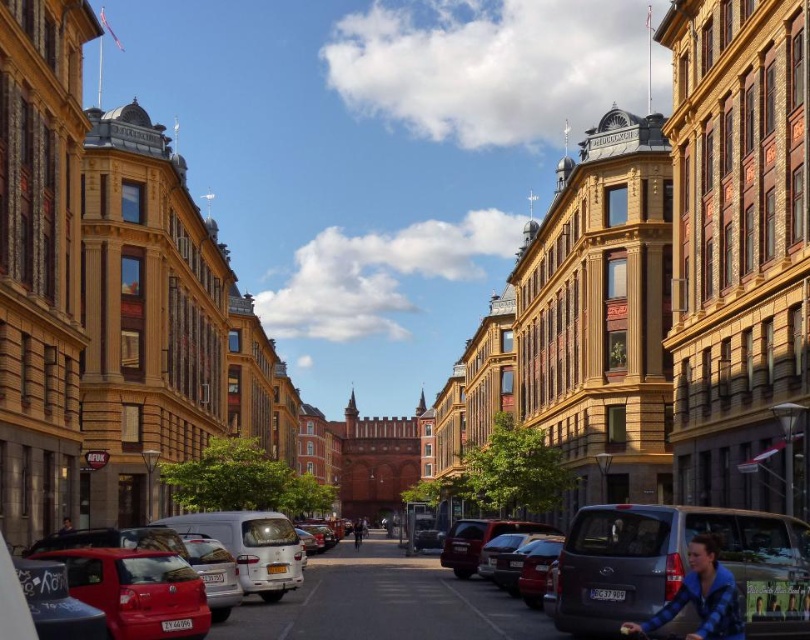
Between dark blue fabric jacket at center and dark blue fabric jacket at lower left, which one is positioned lower?

Positioned lower is dark blue fabric jacket at center.

Does point (356, 529) come behind point (62, 518)?

Yes, it is.

Where is `dark blue fabric jacket at center`? This screenshot has height=640, width=810. dark blue fabric jacket at center is located at coordinates (357, 531).

Is matte gray van at lower right taller than blue fleece jacket at lower right?

Yes.

From the picture: Is matte gray van at lower right shorter than blue fleece jacket at lower right?

No.

Is point (798, 618) positioned behind point (740, 616)?

Yes.

Where is `matte gray van at lower right`? matte gray van at lower right is located at coordinates (678, 566).

From the picture: Does matte gray van at lower right have a lesser height compared to dark blue fabric jacket at center?

Yes.

Does matte gray van at lower right have a lesser width compared to dark blue fabric jacket at center?

In fact, matte gray van at lower right might be wider than dark blue fabric jacket at center.

Between point (762, 532) and point (357, 518), which one is positioned behind?

Positioned behind is point (357, 518).

What are the coordinates of `matte gray van at lower right` in the screenshot? It's located at (678, 566).